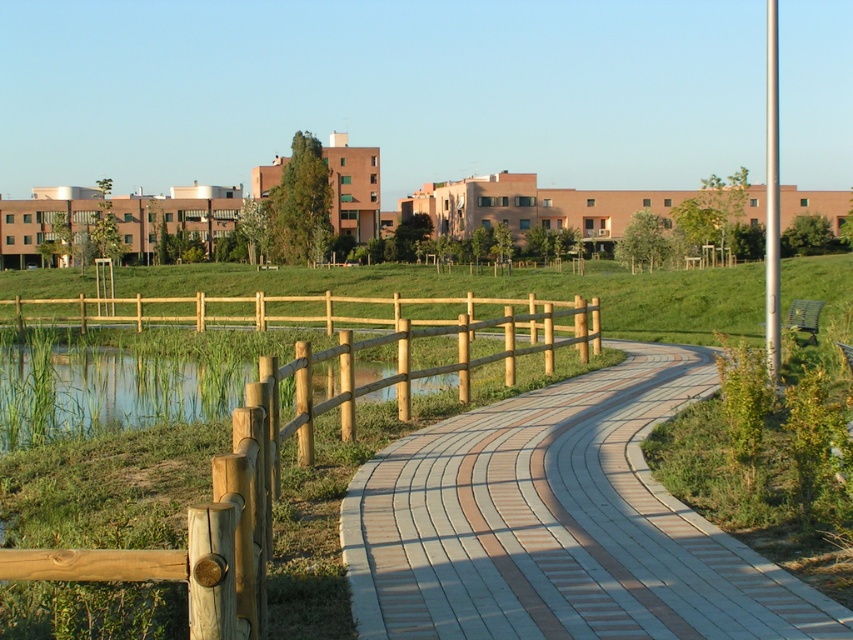
You are a gardener planning to install a 8 feet long decorative fence panel between the brick paved path at center and the wooden fence at left. Based on the scene, will the panel fit in the space between them?

The distance between the brick paved path at center and the wooden fence at left is 7.71 feet. Since the panel is 8 feet long, it will not fit as the space is slightly smaller than the panel.

In the scene shown: You are standing at the start of the brick paved path at center and want to walk towards the wooden fence at left. Is the path to your right or left side?

The brick paved path at center is positioned on the right side of wooden fence at left, so if you are facing the wooden fence at left, the path would be to your right side.

You are standing at the entrance of the pathway and want to reach the brick paved path at center. Which direction should you walk to reach it?

You should walk forward towards the brick paved path at center as it is located at point (560,524), which is ahead of your current position at the entrance.